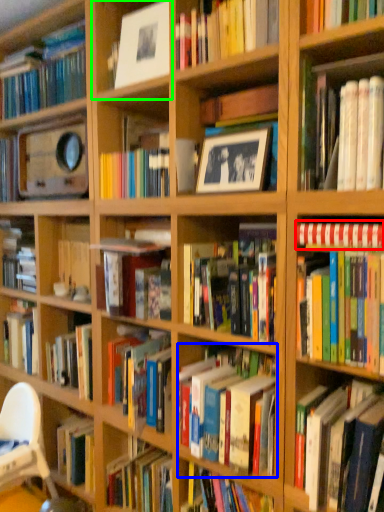
Question: Which object is positioned farthest from book (highlighted by a red box)? Select from book (highlighted by a blue box) and shelf (highlighted by a green box).

Choices:
 (A) book
 (B) shelf

Answer: (B)